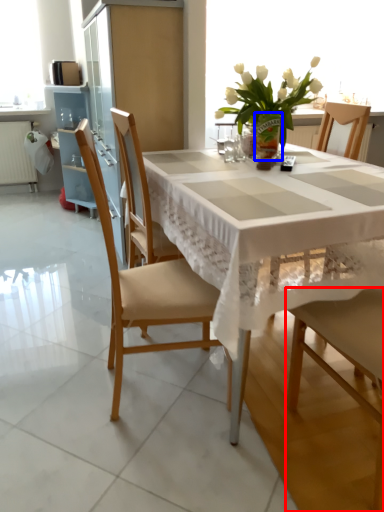
Question: Which object appears farthest to the camera in this image, chair (highlighted by a red box) or vase (highlighted by a blue box)?

Choices:
 (A) chair
 (B) vase

Answer: (B)